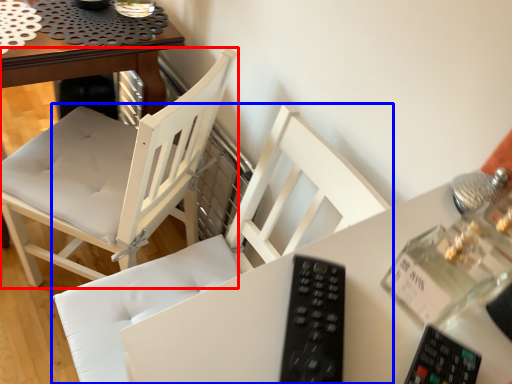
Question: Which object appears farthest to the camera in this image, chair (highlighted by a red box) or chair (highlighted by a blue box)?

Choices:
 (A) chair
 (B) chair

Answer: (A)